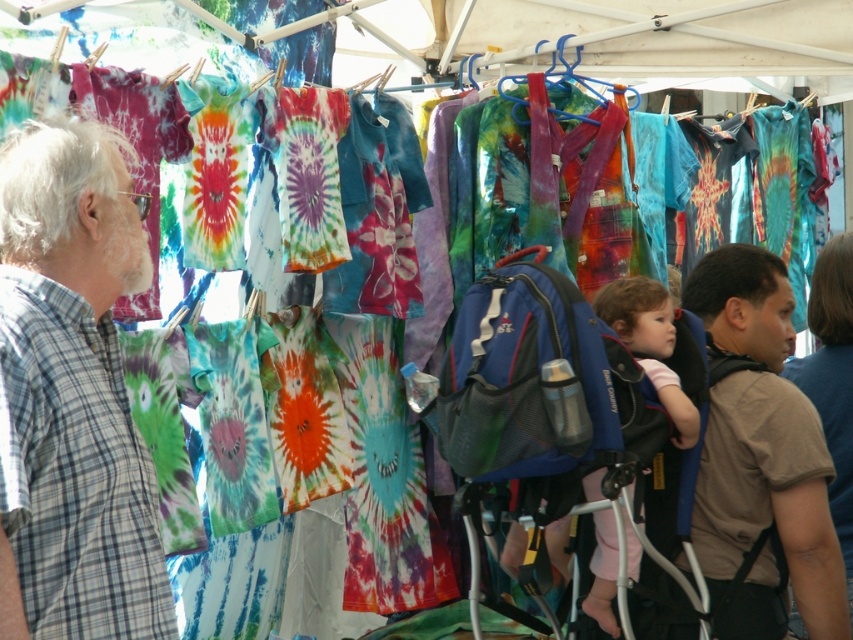
Can you confirm if plaid shirt at left is bigger than pink fabric at center?

Yes.

Does plaid shirt at left appear under pink fabric at center?

Indeed, plaid shirt at left is positioned under pink fabric at center.

At what (x,y) coordinates should I click in order to perform the action: click on plaid shirt at left. Please return your answer as a coordinate pair (x, y). The image size is (853, 640). Looking at the image, I should click on (73, 394).

Who is more forward, (727,244) or (664,397)?

Point (664,397) is in front.

At what (x,y) coordinates should I click in order to perform the action: click on brown cotton t-shirt at center-right. Please return your answer as a coordinate pair (x, y). Image resolution: width=853 pixels, height=640 pixels. Looking at the image, I should click on (763, 440).

Image resolution: width=853 pixels, height=640 pixels. What are the coordinates of `brown cotton t-shirt at center-right` in the screenshot? It's located at (763, 440).

Who is positioned more to the right, plaid shirt at left or brown cotton t-shirt at center-right?

brown cotton t-shirt at center-right is more to the right.

Between plaid shirt at left and brown cotton t-shirt at center-right, which one has more height?

plaid shirt at left

Image resolution: width=853 pixels, height=640 pixels. In order to click on plaid shirt at left in this screenshot , I will do pos(73,394).